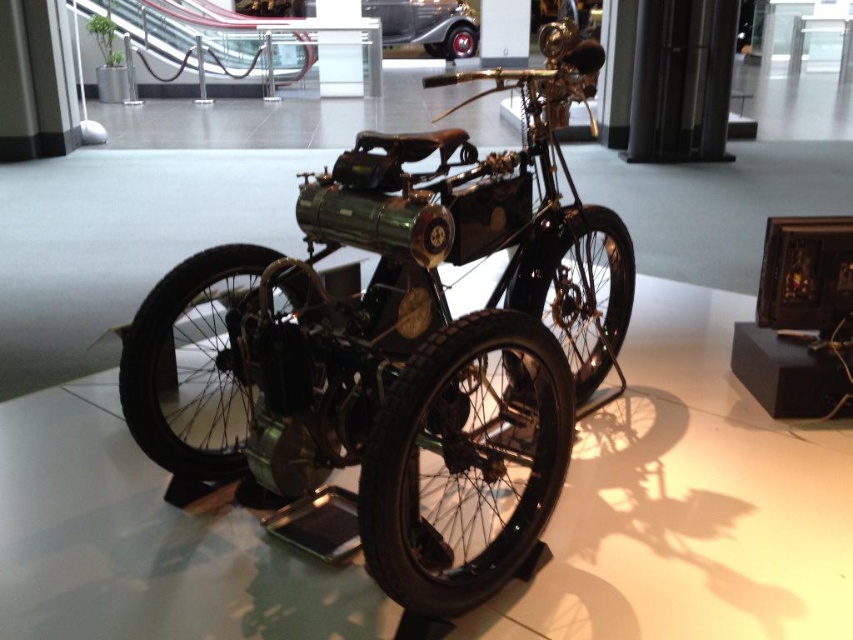
You are standing in the museum and want to take a photo of both point (596,349) and point (468,38). Which point should you focus on first to ensure both are in the frame?

You should focus on point (596,349) first because it is in front of point (468,38), so capturing it first ensures both points are within the camera frame.

You are a tour guide explaining the exhibits in the museum. You need to describe the arrangement of the shiny black motorcycle at center and the shiny chrome car at center to a visitor. Which one is positioned lower in the exhibit?

The shiny black motorcycle at center is positioned lower than the shiny chrome car at center because it is located below it.